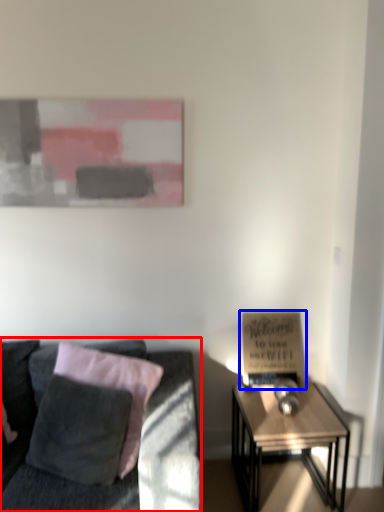
Question: Which object is closer to the camera taking this photo, studio couch (highlighted by a red box) or bulletin board (highlighted by a blue box)?

Choices:
 (A) studio couch
 (B) bulletin board

Answer: (A)